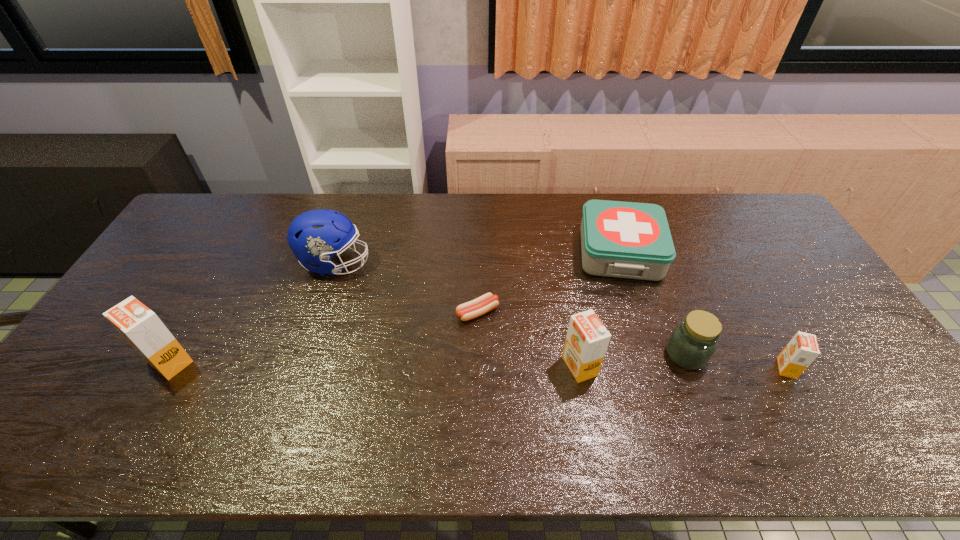
Find the location of `the leftmost orange juice`. the leftmost orange juice is located at coordinates (141, 327).

Find the location of a particular element. Image resolution: width=960 pixels, height=540 pixels. the second tallest orange juice is located at coordinates (587, 339).

Find the location of `the fourth object from left to right`. the fourth object from left to right is located at coordinates (587, 339).

The height and width of the screenshot is (540, 960). In order to click on the rightmost object in this screenshot , I will do `click(802, 350)`.

Locate an element on the screen. The height and width of the screenshot is (540, 960). the shortest orange juice is located at coordinates pos(802,350).

This screenshot has height=540, width=960. In order to click on the third object from left to right in this screenshot , I will do `click(487, 302)`.

Image resolution: width=960 pixels, height=540 pixels. I want to click on the third farthest object, so click(487, 302).

Where is `the sixth object from right to left`? This screenshot has width=960, height=540. the sixth object from right to left is located at coordinates (315, 236).

This screenshot has height=540, width=960. In order to click on the first-aid kit in this screenshot , I will do [x=631, y=240].

Locate an element on the screen. jar is located at coordinates (693, 342).